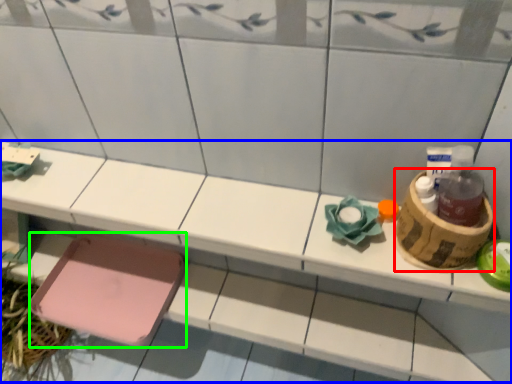
Question: Which object is positioned closest to basket (highlighted by a red box)? Select from vanity (highlighted by a blue box) and step stool (highlighted by a green box).

Choices:
 (A) vanity
 (B) step stool

Answer: (A)